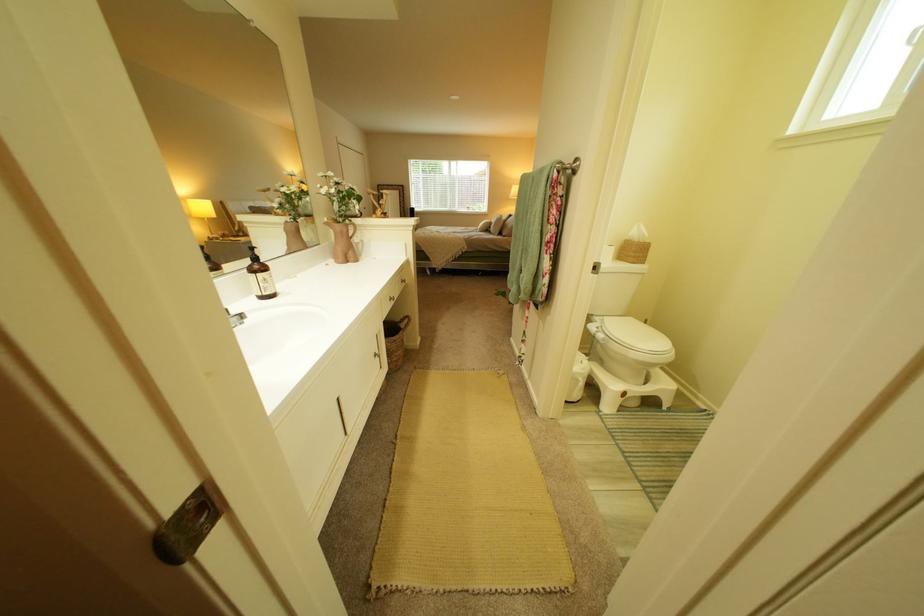
Find where to pull the white cabinet handle. Please return your answer as a coordinate pair (x, y).

(341, 416)